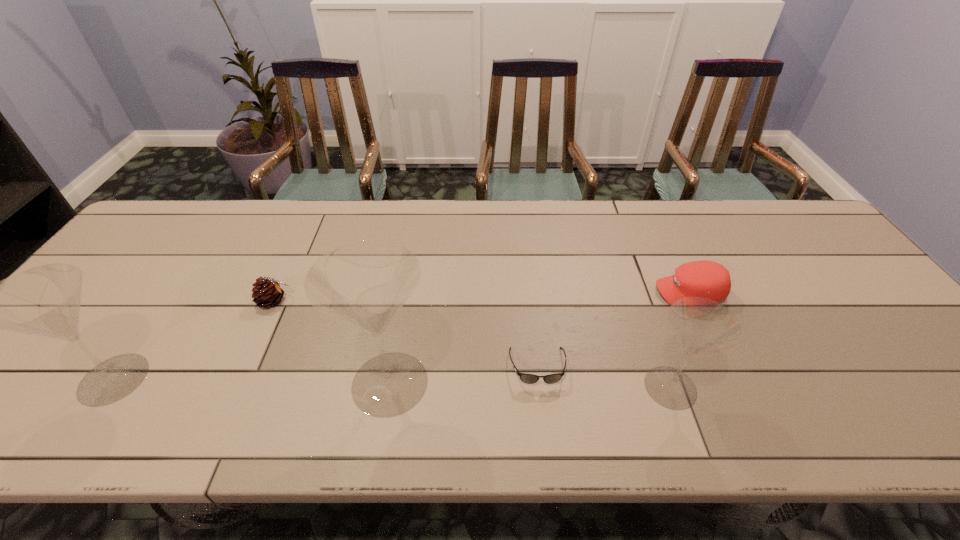
This screenshot has height=540, width=960. I want to click on the leftmost flute glass, so click(x=45, y=300).

The width and height of the screenshot is (960, 540). I want to click on the second tallest object, so click(45, 300).

This screenshot has height=540, width=960. Identify the location of the tallest flute glass. (365, 283).

Where is `the second flute glass from left to right`? the second flute glass from left to right is located at coordinates (365, 283).

The height and width of the screenshot is (540, 960). I want to click on the fourth shortest object, so click(x=702, y=326).

Where is `the rightmost flute glass`? The width and height of the screenshot is (960, 540). the rightmost flute glass is located at coordinates (702, 326).

Find the location of `cap`. cap is located at coordinates (707, 279).

Image resolution: width=960 pixels, height=540 pixels. Identify the location of the second object from left to right. (267, 292).

The image size is (960, 540). What are the coordinates of `the shortest object` in the screenshot? It's located at (524, 377).

At what (x,y) coordinates should I click in order to perform the action: click on sunglasses. Please return your answer as a coordinate pair (x, y). Looking at the image, I should click on (524, 377).